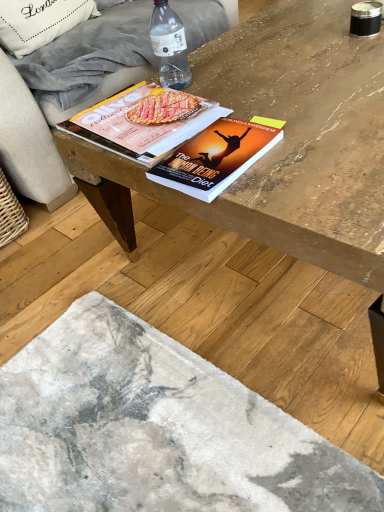
Image resolution: width=384 pixels, height=512 pixels. What are the coordinates of `free point to the right of hardcover book at center, arranged as the 1th book when viewed from the front` in the screenshot? It's located at (316, 145).